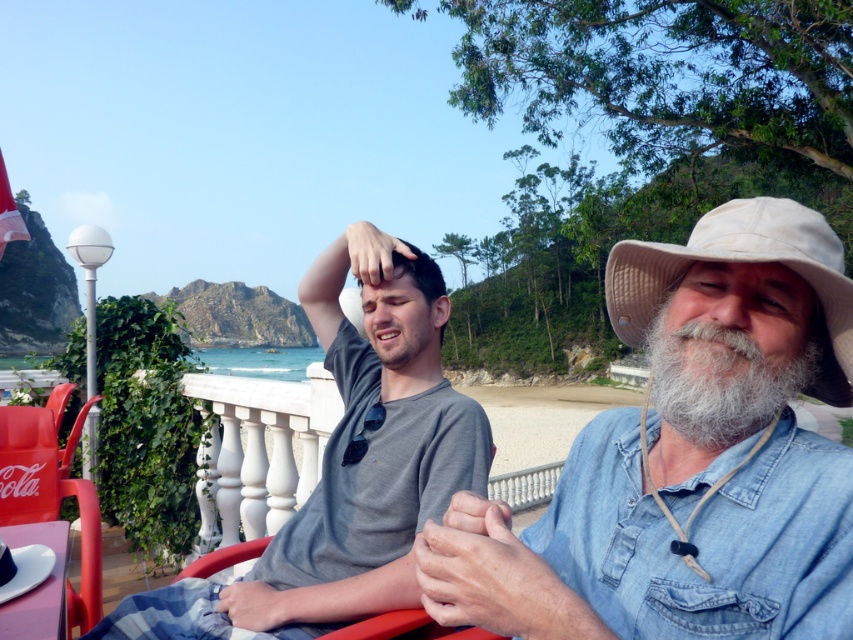
Question: Does gray matte shirt at center appear on the left side of beige fabric cowboy hat at right?

Choices:
 (A) no
 (B) yes

Answer: (B)

Question: Which point is farther from the camera taking this photo?

Choices:
 (A) (712, 344)
 (B) (381, 328)
 (C) (422, 284)

Answer: (C)

Question: Does denim shirt at center appear under matte plastic beach chair at lower left?

Choices:
 (A) yes
 (B) no

Answer: (B)

Question: Can you confirm if gray matte shirt at center is positioned below gray/white/fuzzy beard at right?

Choices:
 (A) no
 (B) yes

Answer: (B)

Question: Which object is farther from the camera taking this photo?

Choices:
 (A) beige fabric cowboy hat at right
 (B) matte skin forehead at center
 (C) denim shirt at center

Answer: (B)

Question: Which point is closer to the camera?

Choices:
 (A) (50, 476)
 (B) (357, 275)

Answer: (B)